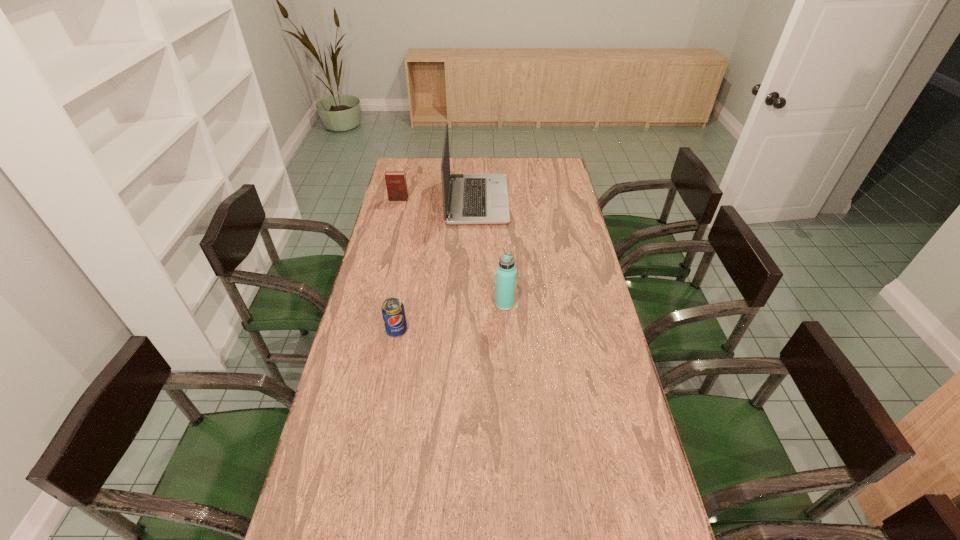
At what (x,y) coordinates should I click in order to perform the action: click on vacant point located between the tallest object and the thermos bottle. Please return your answer as a coordinate pair (x, y). The image size is (960, 540). Looking at the image, I should click on (491, 252).

This screenshot has height=540, width=960. I want to click on free space between the tallest object and the third object from right to left, so click(x=437, y=265).

Identify the location of unoccupied area between the nearest object and the leftmost object. (397, 265).

The image size is (960, 540). Find the location of `the second closest object to the leftmost object`. the second closest object to the leftmost object is located at coordinates (506, 272).

Choose which object is the second nearest neighbor to the thermos bottle. Please provide its 2D coordinates. Your answer should be formatted as a tuple, i.e. [(x, y)], where the tuple contains the x and y coordinates of a point satisfying the conditions above.

[(473, 198)]

Find the location of a particular element. free spot that satisfies the following two spatial constraints: 1. on the back side of the second tallest object; 2. on the screen of the tallest object is located at coordinates (499, 200).